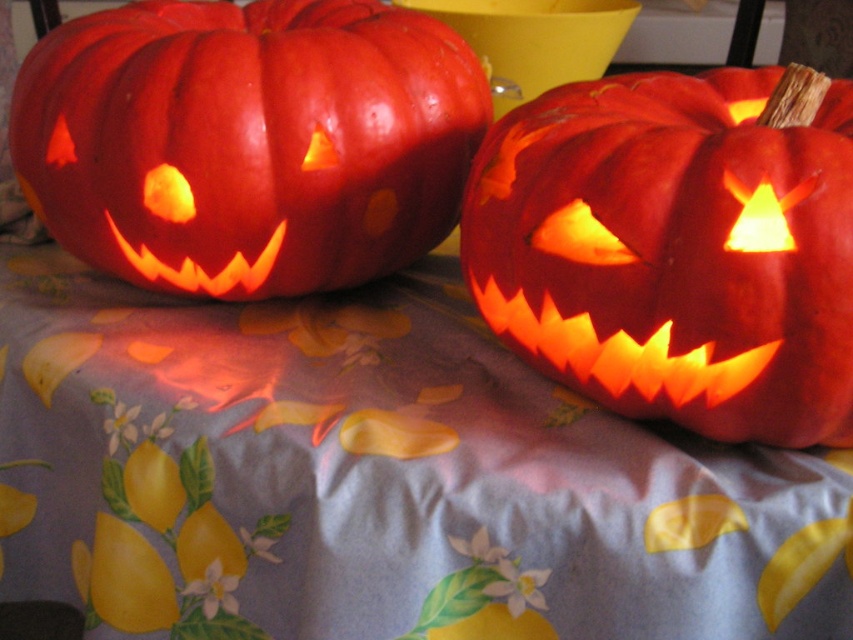
Question: Can you confirm if matte orange pumpkin at center is positioned below matte orange pumpkin at left?

Choices:
 (A) yes
 (B) no

Answer: (A)

Question: Which point is farther to the camera?

Choices:
 (A) (682, 364)
 (B) (460, 164)

Answer: (B)

Question: Is matte orange pumpkin at center to the left of matte orange pumpkin at left from the viewer's perspective?

Choices:
 (A) yes
 (B) no

Answer: (B)

Question: Which point is farther to the camera?

Choices:
 (A) matte orange pumpkin at center
 (B) matte orange pumpkin at left

Answer: (B)

Question: Observing the image, what is the correct spatial positioning of matte orange pumpkin at center in reference to matte orange pumpkin at left?

Choices:
 (A) right
 (B) left

Answer: (A)

Question: Which object is closer to the camera taking this photo?

Choices:
 (A) matte orange pumpkin at left
 (B) matte orange pumpkin at center

Answer: (B)